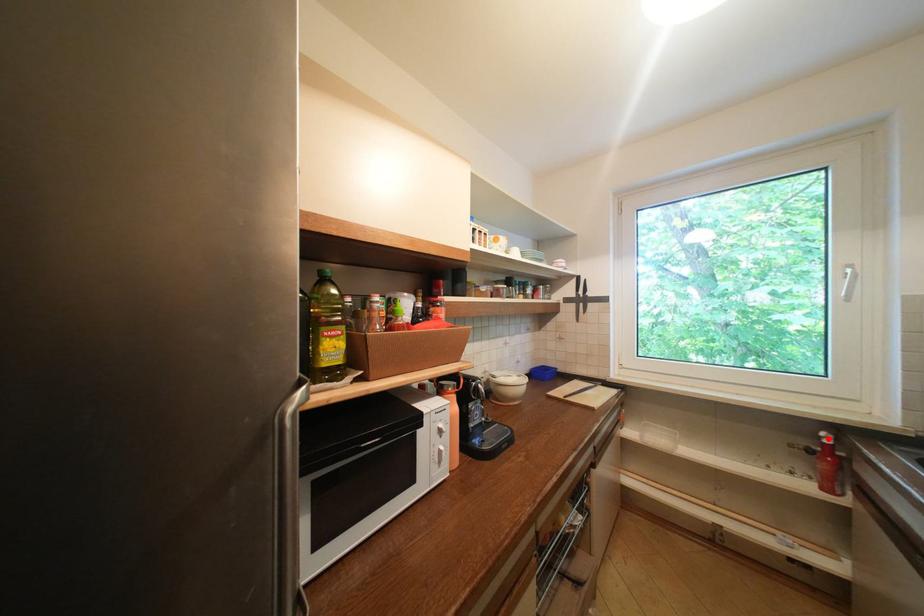
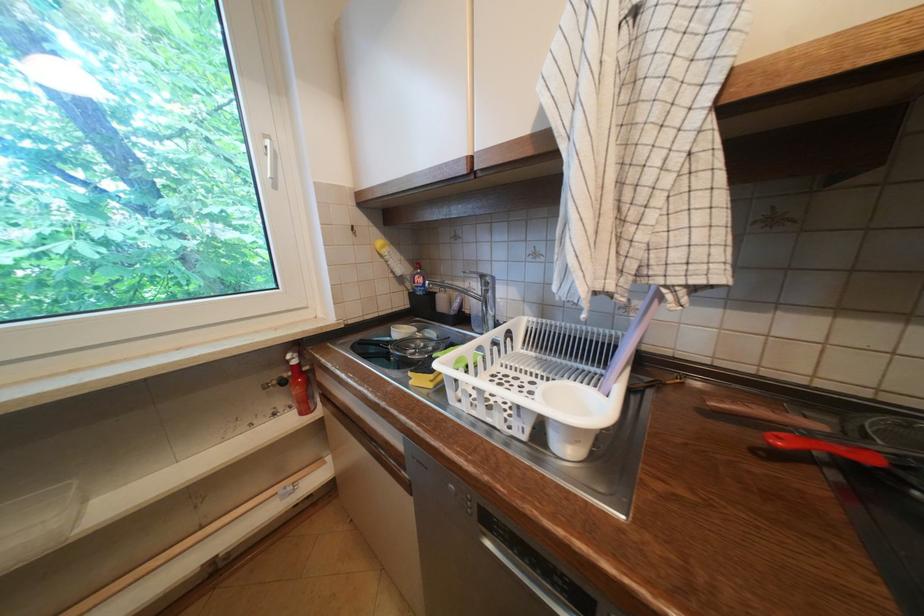
Locate, in the second image, the point that corresponds to the highlighted location in the first image.

(296, 362)